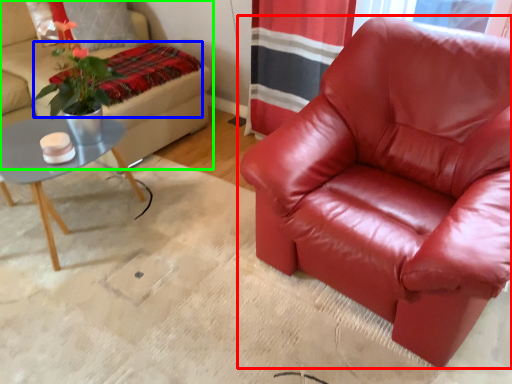
Question: Which object is positioned closest to chair (highlighted by a red box)? Select from blanket (highlighted by a blue box) and studio couch (highlighted by a green box).

Choices:
 (A) blanket
 (B) studio couch

Answer: (A)